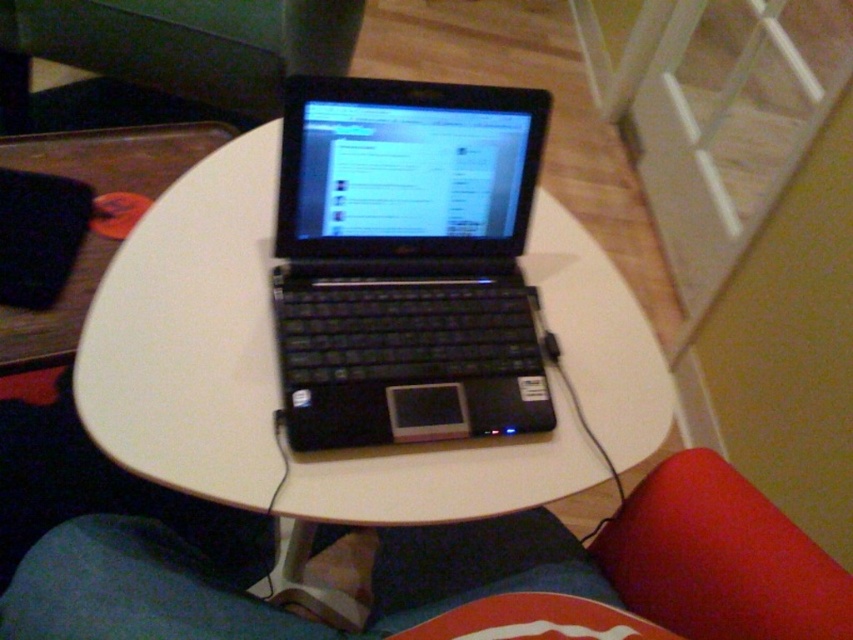
Can you confirm if black matte laptop at center is positioned below blue fabric at center?

Actually, black matte laptop at center is above blue fabric at center.

Between point (316, 177) and point (592, 595), which one is positioned in front?

Point (316, 177) is more forward.

The width and height of the screenshot is (853, 640). What are the coordinates of `black matte laptop at center` in the screenshot? It's located at (405, 262).

Find the location of a particular element. The width and height of the screenshot is (853, 640). white matte round table at center is located at coordinates (267, 376).

Does white matte round table at center come behind black matte laptop at center?

No, it is not.

Is white matte round table at center positioned in front of black matte laptop at center?

Yes, white matte round table at center is closer to the viewer.

Between point (552, 493) and point (474, 156), which one is positioned in front?

Point (552, 493) is in front.

Locate an element on the screen. white matte round table at center is located at coordinates (267, 376).